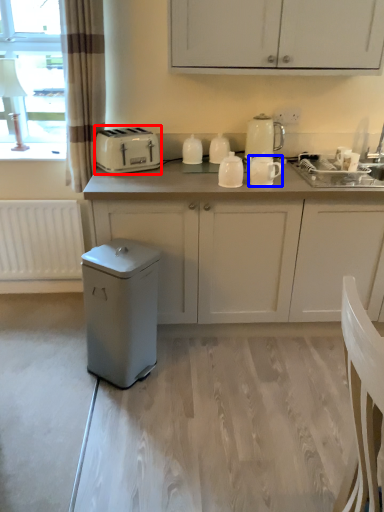
Question: Among these objects, which one is nearest to the camera, toaster (highlighted by a red box) or kitchen appliance (highlighted by a blue box)?

Choices:
 (A) toaster
 (B) kitchen appliance

Answer: (B)